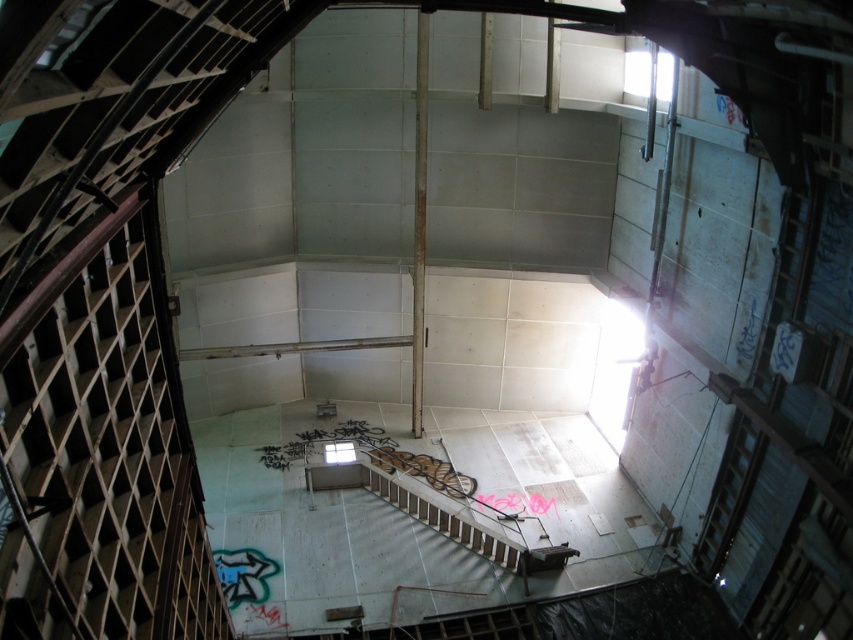
Question: Is wooden at left closer to the viewer compared to white concrete stairs at center?

Choices:
 (A) no
 (B) yes

Answer: (B)

Question: Is wooden at left closer to camera compared to white concrete stairs at center?

Choices:
 (A) no
 (B) yes

Answer: (B)

Question: Which of the following is the farthest from the observer?

Choices:
 (A) (526, 554)
 (B) (117, 282)

Answer: (A)

Question: Which point appears farthest from the camera in this image?

Choices:
 (A) [x=451, y=529]
 (B) [x=138, y=387]

Answer: (A)

Question: Does wooden at left have a smaller size compared to white concrete stairs at center?

Choices:
 (A) yes
 (B) no

Answer: (B)

Question: Among these objects, which one is nearest to the camera?

Choices:
 (A) white concrete stairs at center
 (B) wooden at left

Answer: (B)